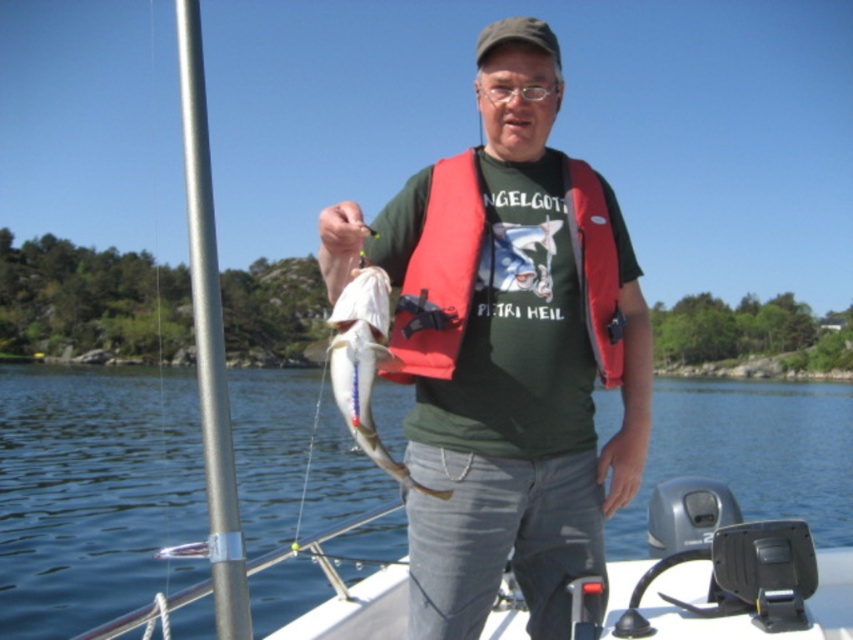
Question: Estimate the real-world distances between objects in this image. Which object is closer to the brushed metal pole at left?

Choices:
 (A) clear blue water at center
 (B) red fabric life jacket at center
 (C) shiny silver fish at center

Answer: (C)

Question: Does brushed metal pole at left have a greater width compared to shiny silver fish at center?

Choices:
 (A) yes
 (B) no

Answer: (A)

Question: Is the position of red fabric life jacket at center more distant than that of shiny silver fish at center?

Choices:
 (A) yes
 (B) no

Answer: (A)

Question: Observing the image, what is the correct spatial positioning of matte green t-shirt at center in reference to red fabric life jacket at center?

Choices:
 (A) left
 (B) right

Answer: (A)

Question: Which point is farther to the camera?

Choices:
 (A) clear blue water at center
 (B) shiny silver fish at center
 (C) brushed metal pole at left

Answer: (A)

Question: Based on their relative distances, which object is farther from the red fabric life jacket at center?

Choices:
 (A) matte green t-shirt at center
 (B) clear blue water at center

Answer: (B)